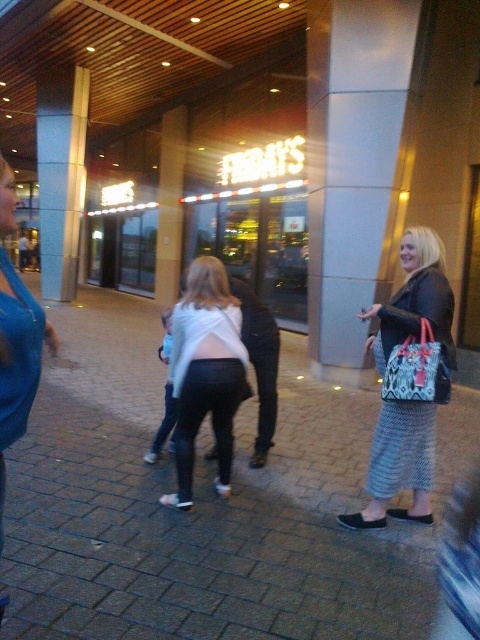
Question: Which of the following is the closest to the observer?

Choices:
 (A) patterned fabric handbag at right
 (B) light blue glass pillar at center
 (C) matte black jacket at right
 (D) white fabric top at center

Answer: (A)

Question: Which point is farther to the camera?

Choices:
 (A) patterned fabric handbag at right
 (B) white fabric top at center
 (C) matte black jacket at right
 (D) metallic gray pillar at center

Answer: (D)

Question: Is metallic gray pillar at center in front of matte black jacket at right?

Choices:
 (A) yes
 (B) no

Answer: (B)

Question: Considering the relative positions of white fabric top at center and patterned fabric handbag at right in the image provided, where is white fabric top at center located with respect to patterned fabric handbag at right?

Choices:
 (A) left
 (B) right

Answer: (A)

Question: Can you confirm if light blue glass pillar at center is thinner than patterned fabric handbag at right?

Choices:
 (A) yes
 (B) no

Answer: (B)

Question: Based on their relative distances, which object is nearer to the white fabric top at center?

Choices:
 (A) matte black jacket at right
 (B) wooden pillar at center
 (C) metallic gray pillar at center
 (D) light blue glass pillar at center

Answer: (A)